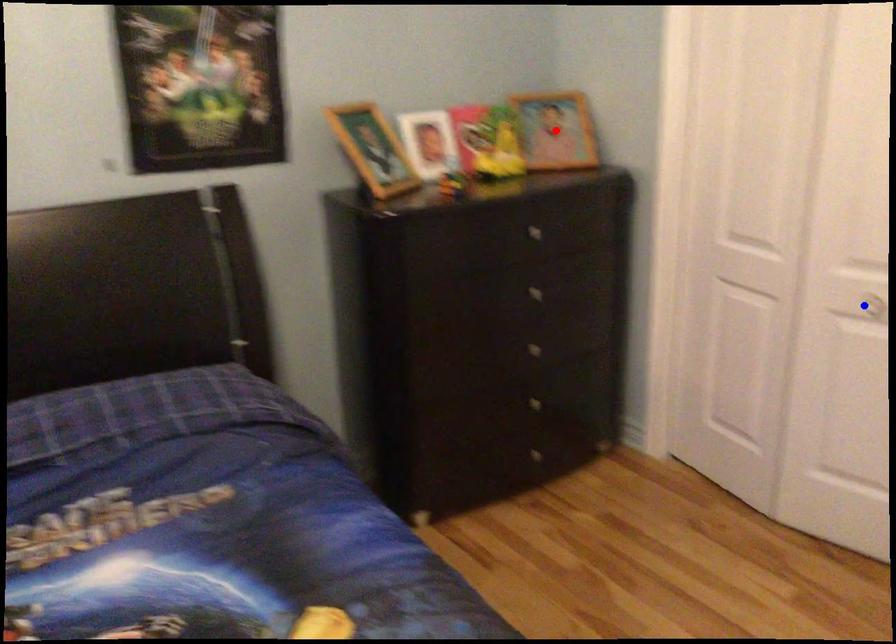
Question: In the image, two points are highlighted. Which point is nearer to the camera? Reply with the corresponding letter.

Choices:
 (A) blue point
 (B) red point

Answer: (A)